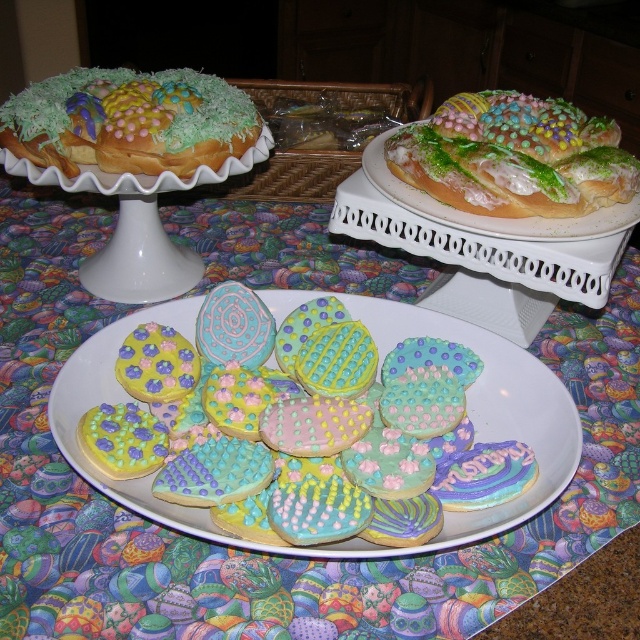
In the scene shown: You are planning to place a ribbon decoration between the matte sugar cookies at center and the pastel frosted pastry at center. Which object should you place the ribbon closer to to ensure it fits within the space available?

The matte sugar cookies at center might be wider than pastel frosted pastry at center, so you should place the ribbon closer to the pastel frosted pastry at center to accommodate the width difference.